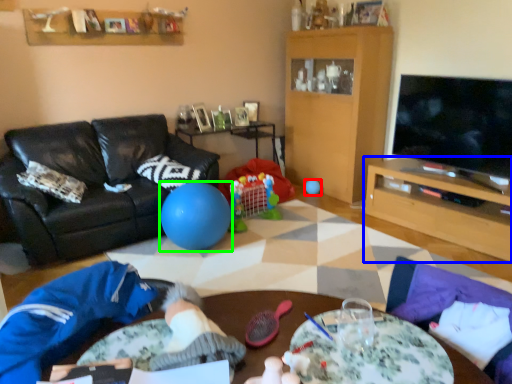
Question: Which object is the farthest from ball (highlighted by a red box)? Choose among these: table (highlighted by a blue box) or ball (highlighted by a green box).

Choices:
 (A) table
 (B) ball

Answer: (B)